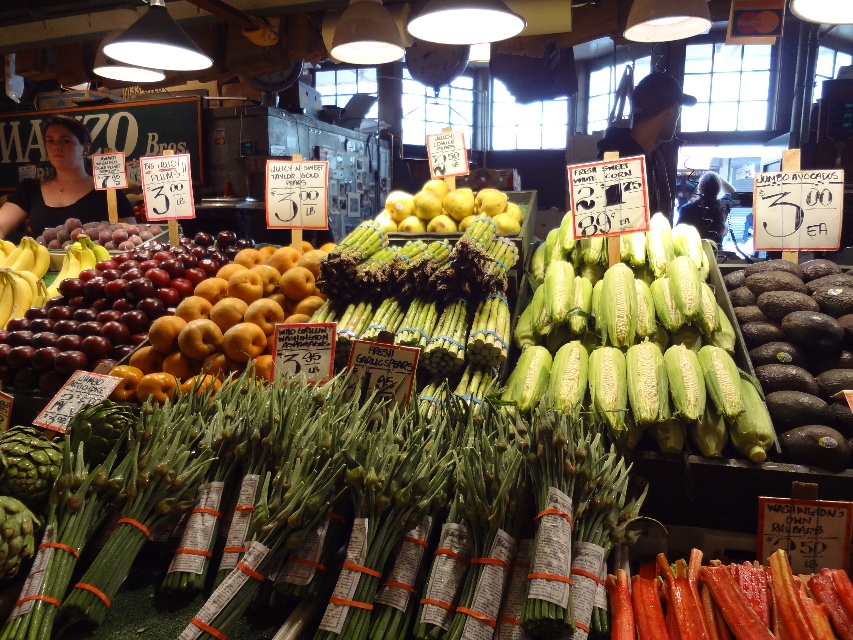
Based on the photo, can you confirm if shiny dark purple grapes at center left is wider than golden yellow peaches at center?

Yes, shiny dark purple grapes at center left is wider than golden yellow peaches at center.

This screenshot has height=640, width=853. I want to click on shiny dark purple grapes at center left, so click(102, 310).

Can you confirm if green corn at center is bigger than wooden signboard at upper left?

No, green corn at center is not bigger than wooden signboard at upper left.

Is point (732, 394) more distant than point (4, 188)?

No, it is not.

Which is in front, point (523, 381) or point (123, 128)?

Positioned in front is point (523, 381).

At what (x,y) coordinates should I click in order to perform the action: click on green corn at center. Please return your answer as a coordinate pair (x, y). Image resolution: width=853 pixels, height=640 pixels. Looking at the image, I should click on (640, 353).

Is point (158, 333) in front of point (387, 200)?

Yes.

Based on the photo, which is more to the left, golden yellow peaches at center or yellow smooth apples at center?

From the viewer's perspective, golden yellow peaches at center appears more on the left side.

Which is behind, point (196, 314) or point (466, 214)?

The point (466, 214) is behind.

The height and width of the screenshot is (640, 853). Find the location of `golden yellow peaches at center`. golden yellow peaches at center is located at coordinates (216, 330).